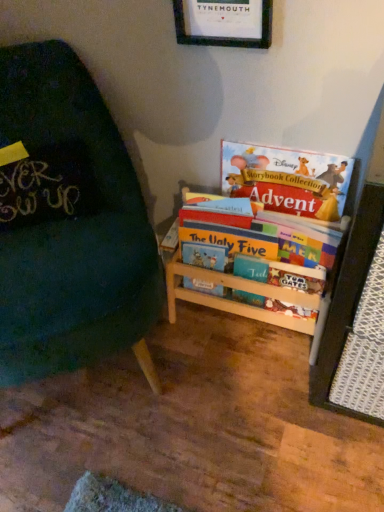
Question: Is point (248, 196) closer or farther from the camera than point (263, 289)?

Choices:
 (A) closer
 (B) farther

Answer: (A)

Question: From the image's perspective, relative to wooden bookshelf at center, is matte paper book at upper right, positioned as the first book in top-to-bottom order, above or below?

Choices:
 (A) below
 (B) above

Answer: (B)

Question: Which object is the farthest from the multicolored cardboard bookshelf at right, the 1th book positioned from the bottom?

Choices:
 (A) green fabric chair at left
 (B) matte paper book at upper right, positioned as the first book in top-to-bottom order
 (C) wooden picture frame at upper center
 (D) wooden bookshelf at center

Answer: (A)

Question: Which object is the farthest from the wooden bookshelf at center?

Choices:
 (A) green fabric chair at left
 (B) wooden picture frame at upper center
 (C) multicolored cardboard bookshelf at right, which is counted as the 2th book, starting from the top
 (D) matte paper book at upper right, positioned as the first book in top-to-bottom order

Answer: (B)